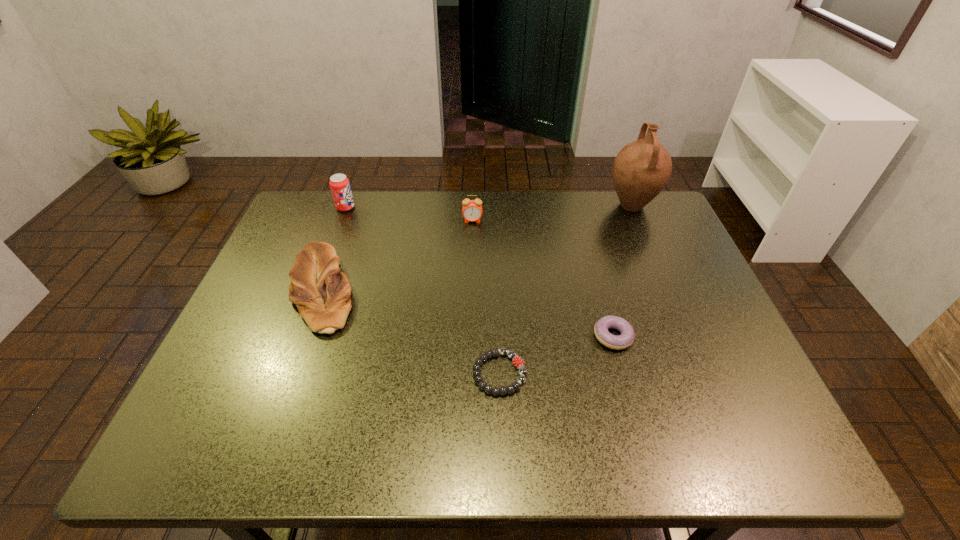
The image size is (960, 540). What are the coordinates of `the rightmost object` in the screenshot? It's located at (642, 168).

The height and width of the screenshot is (540, 960). What are the coordinates of `pitcher` in the screenshot? It's located at (642, 168).

I want to click on the fifth shortest object, so click(340, 187).

Where is `the fourth shortest object`? the fourth shortest object is located at coordinates (472, 209).

This screenshot has height=540, width=960. I want to click on bread, so coord(321,292).

You are a GUI agent. You are given a task and a screenshot of the screen. Output one action in this format:
    pyautogui.click(x=<x>, y=<y>)
    Task: Click on the second shortest object
    The width and height of the screenshot is (960, 540).
    Given the screenshot: What is the action you would take?
    pyautogui.click(x=627, y=336)

Locate an element on the screen. The height and width of the screenshot is (540, 960). the second object from right to left is located at coordinates (627, 336).

The width and height of the screenshot is (960, 540). What are the coordinates of `bracelet` in the screenshot? It's located at 517,361.

You are a GUI agent. You are given a task and a screenshot of the screen. Output one action in this format:
    pyautogui.click(x=<x>, y=<y>)
    Task: Click on the vacant region located on the left of the rightmost object
    The width and height of the screenshot is (960, 540).
    Given the screenshot: What is the action you would take?
    pyautogui.click(x=493, y=206)

Locate an element on the screen. This screenshot has width=960, height=540. vacant space located 0.130m on the surface of the soda can is located at coordinates (396, 207).